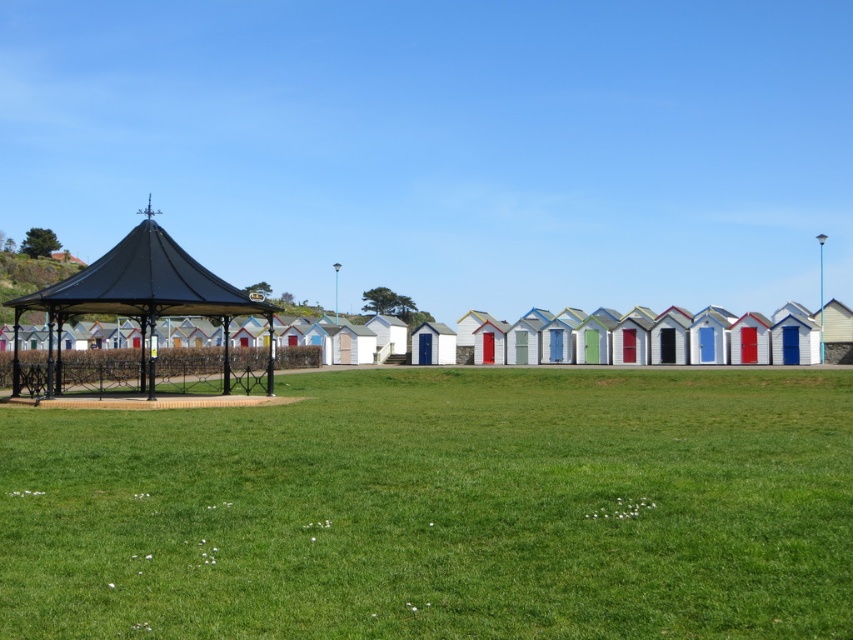
Which is above, green grass at center or black metal gazebo at left?

Positioned higher is black metal gazebo at left.

Is the position of green grass at center more distant than that of black metal gazebo at left?

No, it is not.

Does point (318, 547) come closer to viewer compared to point (239, 308)?

Yes, it is.

The height and width of the screenshot is (640, 853). In order to click on green grass at center in this screenshot , I will do `click(440, 509)`.